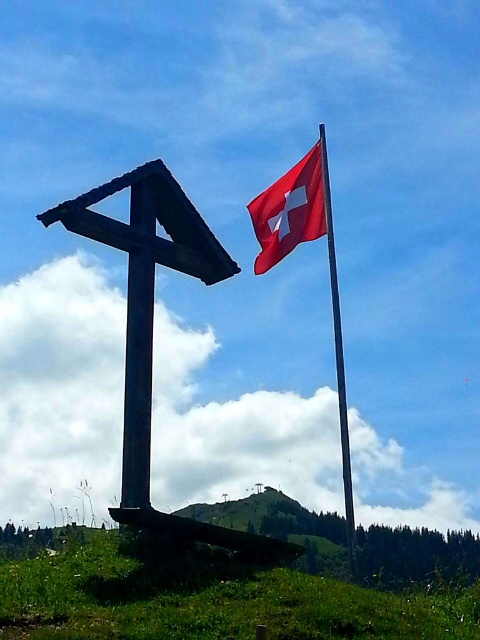
You are standing at the base of the dark brown wooden cross at left and want to walk to the green grassy hillside at lower center. Which direction should you head?

The green grassy hillside at lower center is positioned on the right side of the dark brown wooden cross at left, so you should head to the right to reach it.

You are standing at the point marked by the coordinate point at point (144, 285). Looking towards the dark brown wooden cross at left, which direction should you walk to reach the Swiss flag on the tall pole to the right?

The dark brown wooden cross at left is marked by the point at (144, 285). To reach the Swiss flag on the tall pole to the right, you should walk towards the right direction from the cross.

You are a photographer standing at the base of the dark brown wooden cross at left. You want to take a photo of the red fabric flag at upper right without the cross blocking the view. Can you move forward enough to do so while staying within 5 feet of the cross?

The dark brown wooden cross at left is 5.60 feet away from the red fabric flag at upper right. Since you need to stay within 5 feet of the cross, moving forward 5 feet would leave you 0.60 feet away from the flag, which is enough space to avoid the cross blocking the view. Yes, you can take the photo.